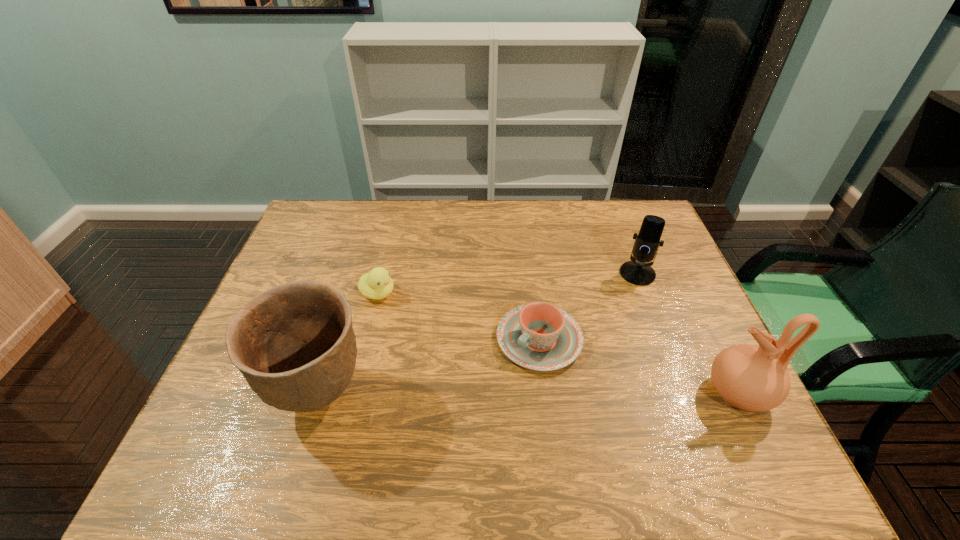
This screenshot has width=960, height=540. Find the location of `pottery that is at the right edge`. pottery that is at the right edge is located at coordinates (747, 377).

Where is `microphone present at the right edge`? microphone present at the right edge is located at coordinates (638, 271).

This screenshot has width=960, height=540. I want to click on object present at the near left corner, so click(x=294, y=343).

Locate an element on the screen. object located at the near right corner is located at coordinates (747, 377).

The image size is (960, 540). I want to click on blank space at the far edge of the desktop, so click(x=583, y=214).

In the image, there is a desktop. Where is `vacant space at the near edge`? The image size is (960, 540). vacant space at the near edge is located at coordinates (674, 409).

The height and width of the screenshot is (540, 960). What are the coordinates of `vacant space at the right edge` in the screenshot? It's located at [x=690, y=355].

In the image, there is a desktop. Identify the location of vacant area at the far left corner. The image size is (960, 540). (340, 224).

Find the location of `free space at the near left corner of the desktop`. free space at the near left corner of the desktop is located at coordinates (255, 423).

Where is `vacant region at the near right corner`? This screenshot has width=960, height=540. vacant region at the near right corner is located at coordinates (747, 417).